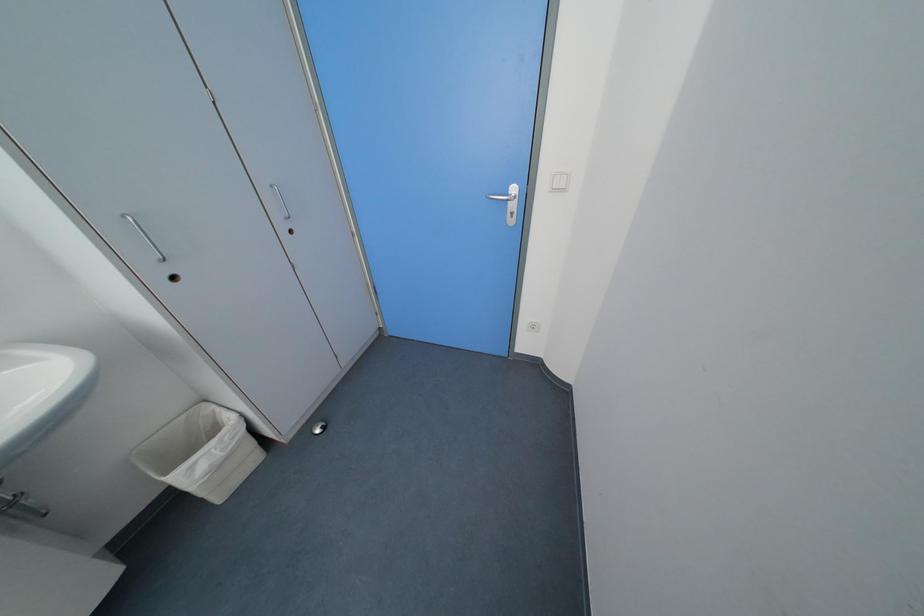
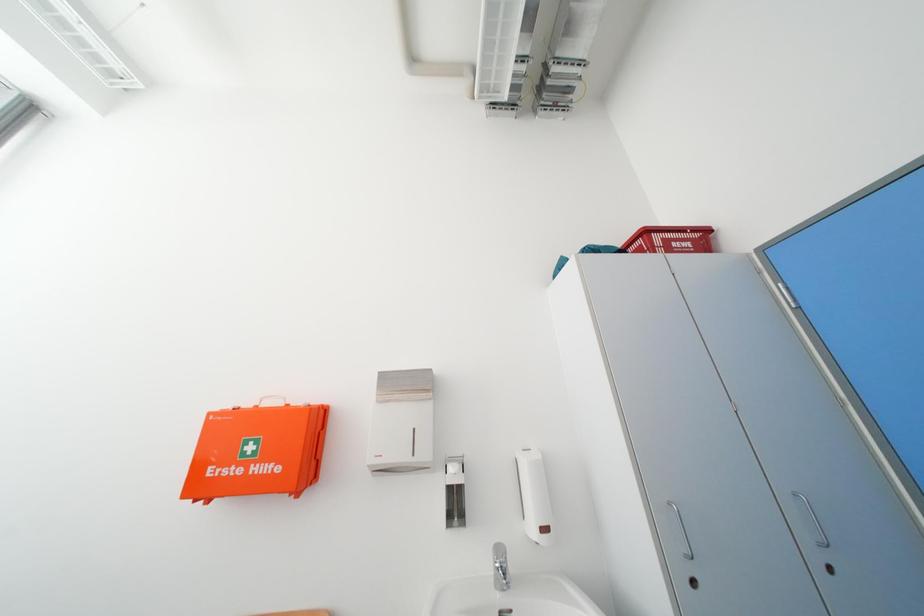
How did the camera likely rotate?

The rotation direction of the camera is left-up.